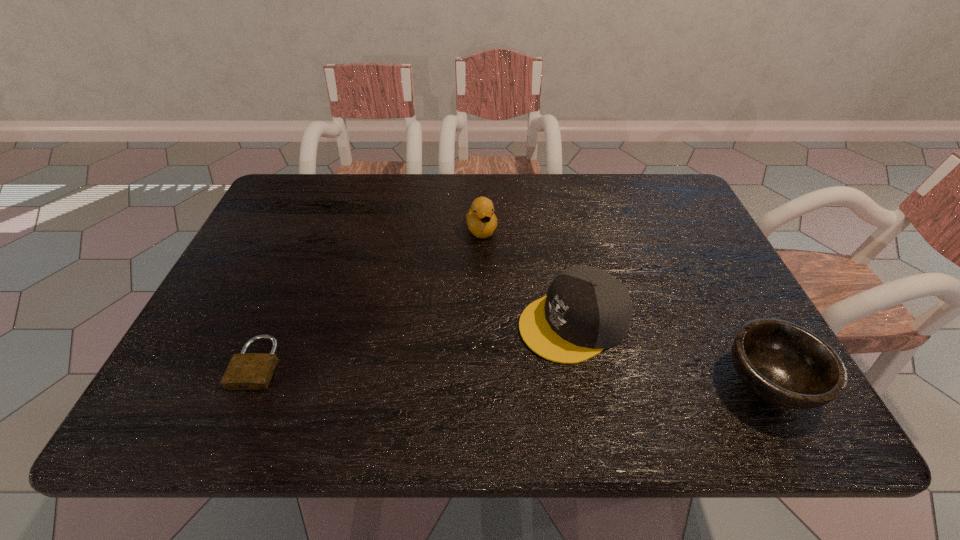
This screenshot has width=960, height=540. What are the coordinates of `free space on the desktop that is between the shortest object and the rightmost object and is positioned on the face of the duckling` in the screenshot? It's located at (523, 373).

Locate an element on the screen. free space on the desktop that is between the padlock and the second shortest object and is positioned on the front-facing side of the cap is located at coordinates (468, 371).